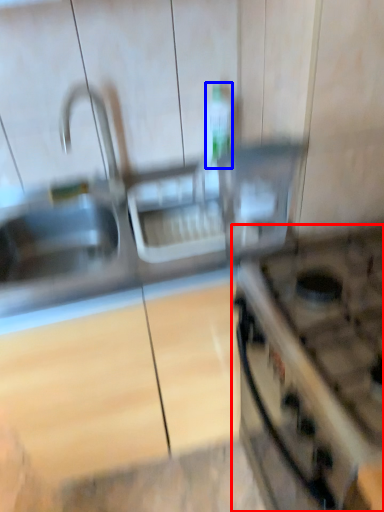
Question: Which object appears farthest to the camera in this image, gas stove (highlighted by a red box) or bottle (highlighted by a blue box)?

Choices:
 (A) gas stove
 (B) bottle

Answer: (B)